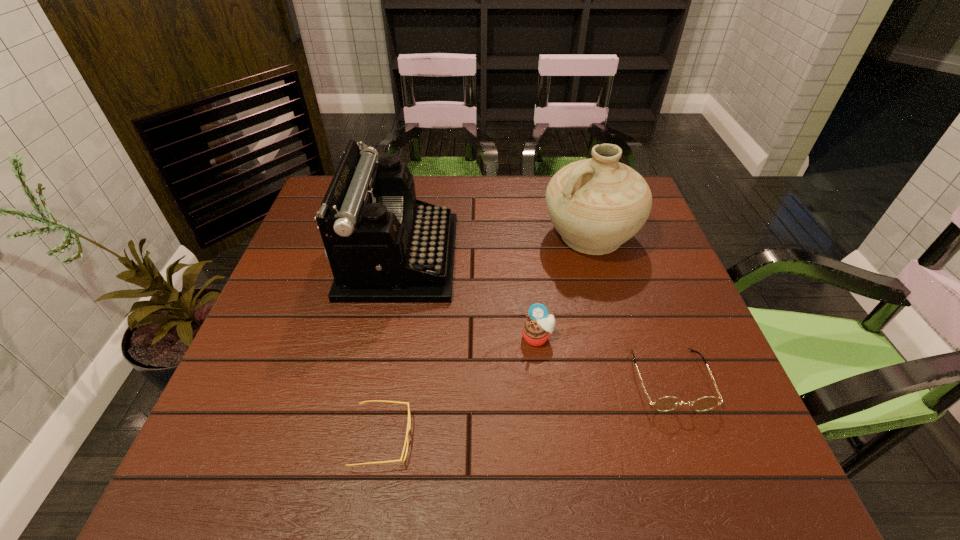
Locate an element on the screen. Image resolution: width=960 pixels, height=540 pixels. typewriter is located at coordinates (384, 246).

You are a GUI agent. You are given a task and a screenshot of the screen. Output one action in this format:
    pyautogui.click(x=<x>, y=<y>)
    Task: Click on the pottery
    This screenshot has width=960, height=540.
    Given the screenshot: What is the action you would take?
    pyautogui.click(x=597, y=204)

The width and height of the screenshot is (960, 540). I want to click on the third nearest object, so click(x=536, y=329).

Image resolution: width=960 pixels, height=540 pixels. I want to click on muffin, so click(536, 329).

At what (x,y) coordinates should I click in order to perform the action: click on the right spectacles. Please return your answer as a coordinate pair (x, y). The height and width of the screenshot is (540, 960). Looking at the image, I should click on (667, 403).

Locate an element on the screen. This screenshot has height=540, width=960. the fourth tallest object is located at coordinates (667, 403).

Where is `the shorter spectacles`? The width and height of the screenshot is (960, 540). the shorter spectacles is located at coordinates (408, 424).

Where is `the left spectacles`? Image resolution: width=960 pixels, height=540 pixels. the left spectacles is located at coordinates (408, 424).

The height and width of the screenshot is (540, 960). In order to click on vacant space situated on the typing side of the typewriter in this screenshot , I will do `click(485, 257)`.

I want to click on free spot located on the front of the pottery, so pyautogui.click(x=606, y=291).